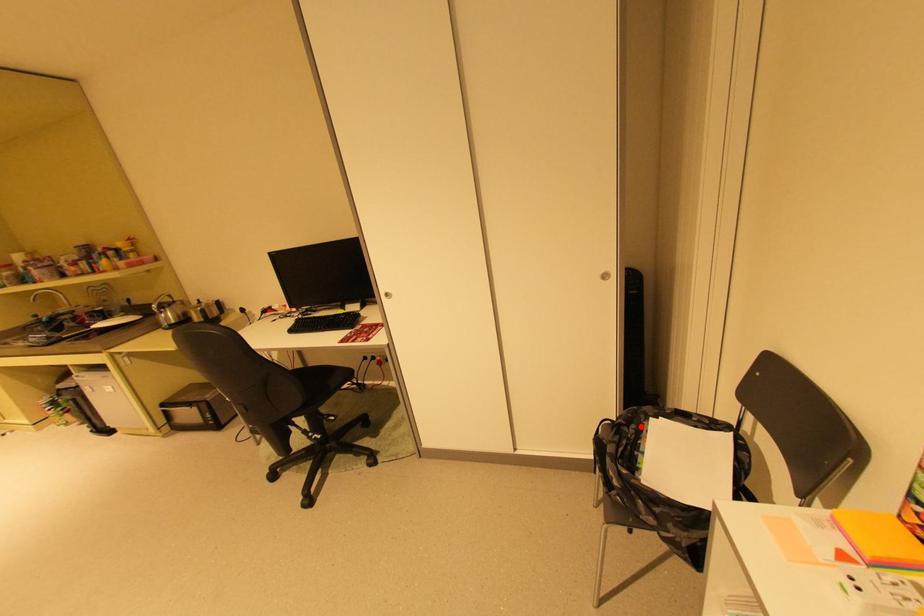
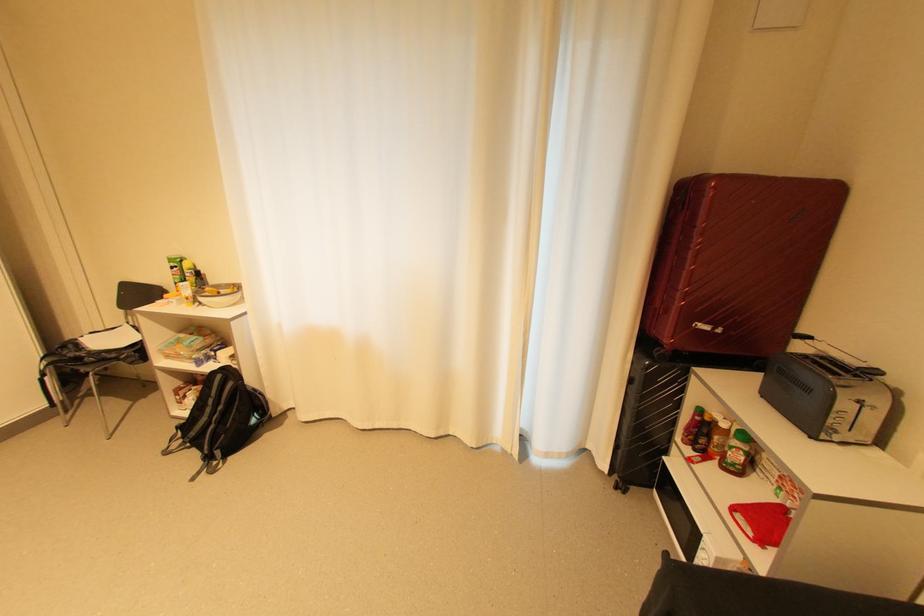
In the second image, find the point that corresponds to the highlighted location in the first image.

(79, 346)